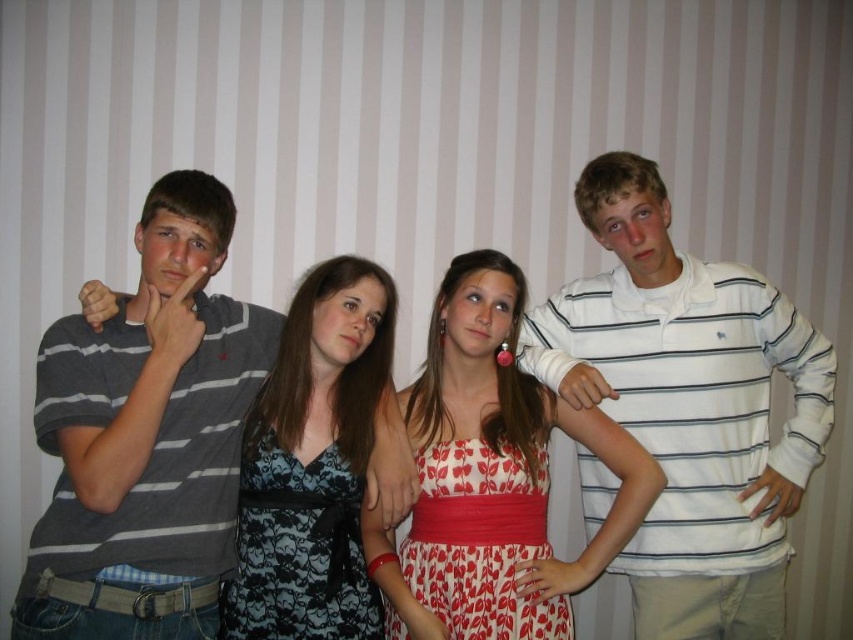
From the picture: Which is more to the right, gray striped shirt at left or dark blue floral dress at center?

Positioned to the right is dark blue floral dress at center.

Image resolution: width=853 pixels, height=640 pixels. What do you see at coordinates (146, 436) in the screenshot? I see `gray striped shirt at left` at bounding box center [146, 436].

Locate an element on the screen. The height and width of the screenshot is (640, 853). gray striped shirt at left is located at coordinates (146, 436).

Image resolution: width=853 pixels, height=640 pixels. Describe the element at coordinates (146, 436) in the screenshot. I see `gray striped shirt at left` at that location.

I want to click on gray striped shirt at left, so click(x=146, y=436).

I want to click on gray striped shirt at left, so click(x=146, y=436).

Can you confirm if white striped polo shirt at right is positioned to the left of printed cotton dress at center?

In fact, white striped polo shirt at right is to the right of printed cotton dress at center.

This screenshot has width=853, height=640. Describe the element at coordinates (689, 406) in the screenshot. I see `white striped polo shirt at right` at that location.

Does point (734, 368) come farther from viewer compared to point (422, 454)?

That is True.

Locate an element on the screen. The image size is (853, 640). white striped polo shirt at right is located at coordinates 689,406.